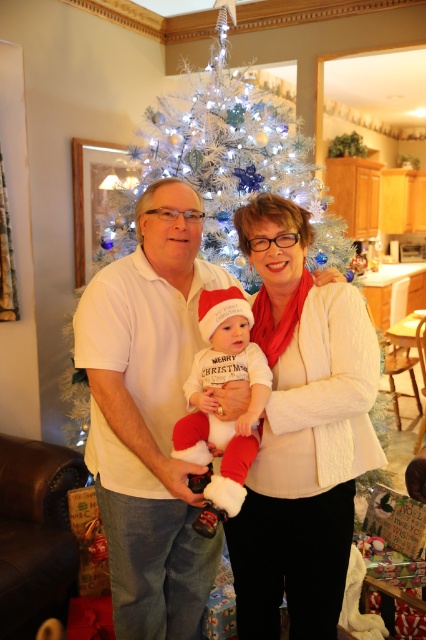
Which is in front, point (210, 547) or point (339, 244)?

Point (210, 547)

Is point (170, 188) in front of point (106, 220)?

Yes, point (170, 188) is in front of point (106, 220).

Locate an element on the screen. white cotton shirt at center is located at coordinates (149, 416).

Which is above, white cable-knit sweater at center or white soft baby at center?

white soft baby at center is higher up.

Who is more distant from viewer, (x=302, y=236) or (x=244, y=333)?

Point (x=302, y=236)

The image size is (426, 640). What are the coordinates of `white cable-knit sweater at center` in the screenshot? It's located at (302, 433).

Can you confirm if white cotton shirt at center is positioned below white soft baby at center?

Indeed, white cotton shirt at center is positioned under white soft baby at center.

Can you confirm if white cotton shirt at center is shorter than white soft baby at center?

Incorrect, white cotton shirt at center's height does not fall short of white soft baby at center's.

Measure the distance between white cotton shirt at center and camera.

white cotton shirt at center is 4.58 feet away from camera.

Locate an element on the screen. white cotton shirt at center is located at coordinates (149, 416).